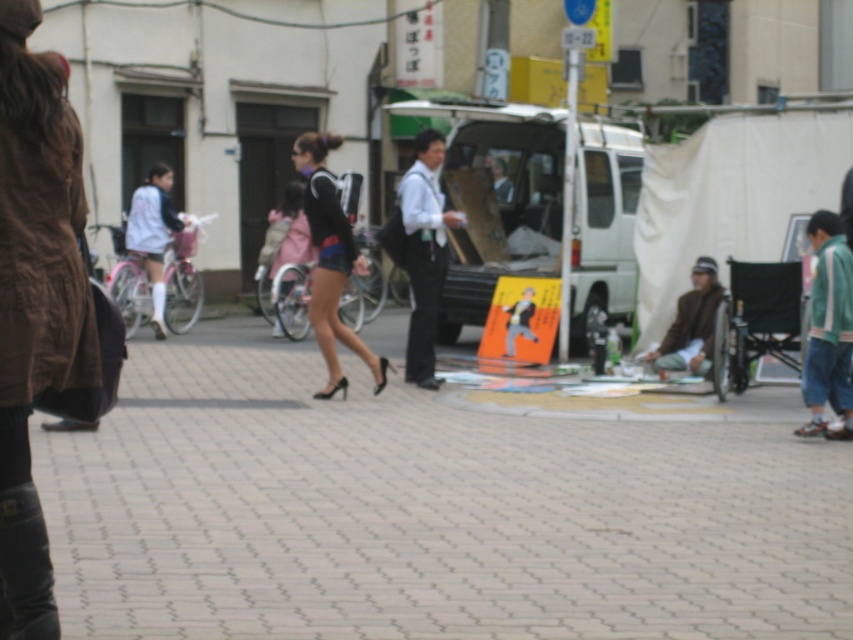
Does point (781, 452) come in front of point (491, 280)?

Yes, point (781, 452) is in front of point (491, 280).

Can you confirm if paved stone sidewalk at center is smaller than white matte van at center?

No, paved stone sidewalk at center is not smaller than white matte van at center.

Locate an element on the screen. This screenshot has height=640, width=853. paved stone sidewalk at center is located at coordinates (428, 512).

Where is `paved stone sidewalk at center`? The height and width of the screenshot is (640, 853). paved stone sidewalk at center is located at coordinates (428, 512).

Which of these two, white matte van at center or matte black shorts at center, stands taller?

Standing taller between the two is white matte van at center.

Can you confirm if white matte van at center is smaller than matte black shorts at center?

Actually, white matte van at center might be larger than matte black shorts at center.

Describe the element at coordinates (496, 196) in the screenshot. I see `white matte van at center` at that location.

Where is `white matte van at center`? Image resolution: width=853 pixels, height=640 pixels. white matte van at center is located at coordinates (496, 196).

Between point (367, 420) and point (28, 563), which one is positioned behind?

The point (367, 420) is more distant.

Which is more to the left, paved stone sidewalk at center or black leather boot at lower left?

black leather boot at lower left is more to the left.

Does point (706, 525) lie behind point (48, 556)?

Yes.

I want to click on paved stone sidewalk at center, so click(x=428, y=512).